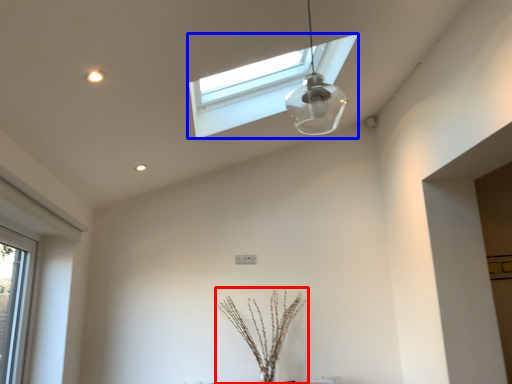
Question: Which of the following is the closest to the observer, plant (highlighted by a red box) or window (highlighted by a blue box)?

Choices:
 (A) plant
 (B) window

Answer: (B)